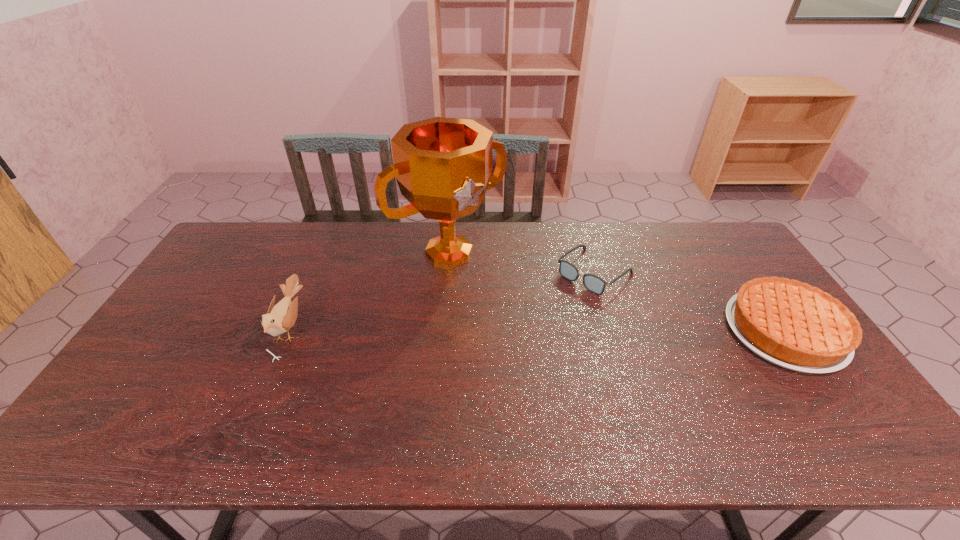
Locate an element on the screen. free space at the far edge of the desktop is located at coordinates (492, 242).

Locate an element on the screen. This screenshot has width=960, height=540. free space at the near edge is located at coordinates (283, 393).

Image resolution: width=960 pixels, height=540 pixels. In the image, there is a desktop. Identify the location of free space at the left edge. (223, 315).

I want to click on vacant space at the right edge of the desktop, so click(719, 286).

The image size is (960, 540). In order to click on free location at the near left corner in this screenshot , I will do `click(137, 404)`.

Identify the location of vacant space at the near right corner of the desktop. (837, 397).

I want to click on free space that is in between the shortest object and the third object from right to left, so click(522, 261).

Where is `empty space between the shortest object and the bird`? The width and height of the screenshot is (960, 540). empty space between the shortest object and the bird is located at coordinates (442, 300).

Find the location of `free spot between the rightmost object and the second object from right to left`. free spot between the rightmost object and the second object from right to left is located at coordinates (690, 301).

Where is `vacant space that is in between the third object from right to left and the spectacles`? This screenshot has width=960, height=540. vacant space that is in between the third object from right to left and the spectacles is located at coordinates [522, 261].